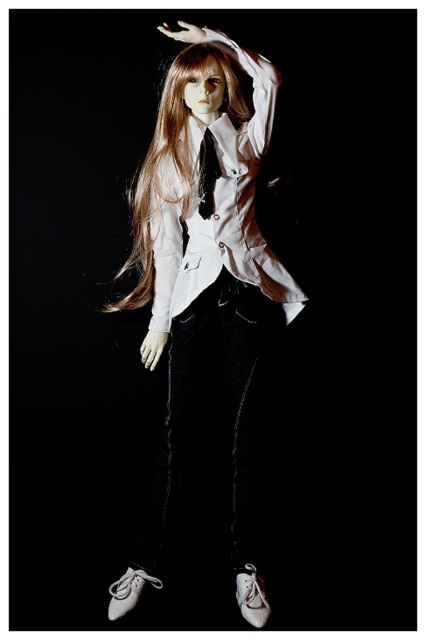
Question: Is white leather shoe at lower left closer to camera compared to black satin tie at center?

Choices:
 (A) no
 (B) yes

Answer: (B)

Question: Which point is farther to the camera?

Choices:
 (A) (146, 368)
 (B) (198, 179)

Answer: (A)

Question: Among these points, which one is farthest from the camera?

Choices:
 (A) (212, 211)
 (B) (147, 250)
 (C) (227, 406)

Answer: (C)

Question: Does black velvet pants at center appear on the right side of white leather shoe at lower left?

Choices:
 (A) no
 (B) yes

Answer: (A)

Question: Does smooth brown hair at center appear over white leather shoe at lower left?

Choices:
 (A) yes
 (B) no

Answer: (A)

Question: Which object is farther from the camera taking this photo?

Choices:
 (A) white leather shoe at lower left
 (B) smooth brown hair at center

Answer: (A)